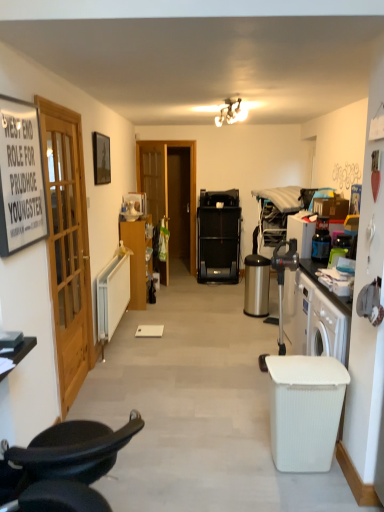
Question: Is satin silver trash can at lower right, which is the second trash bin/can in front-to-back order, at the right side of matte white light fixture at upper center?

Choices:
 (A) yes
 (B) no

Answer: (A)

Question: Is satin silver trash can at lower right, marked as the first trash bin/can in a back-to-front arrangement, wider than matte white light fixture at upper center?

Choices:
 (A) yes
 (B) no

Answer: (B)

Question: Considering the relative positions of satin silver trash can at lower right, which is the second trash bin/can in front-to-back order, and matte white light fixture at upper center in the image provided, is satin silver trash can at lower right, which is the second trash bin/can in front-to-back order, to the left of matte white light fixture at upper center from the viewer's perspective?

Choices:
 (A) no
 (B) yes

Answer: (A)

Question: Can you confirm if satin silver trash can at lower right, which is the second trash bin/can in front-to-back order, is thinner than matte white light fixture at upper center?

Choices:
 (A) no
 (B) yes

Answer: (B)

Question: Is satin silver trash can at lower right, positioned as the second trash bin/can in bottom-to-top order, turned away from matte white light fixture at upper center?

Choices:
 (A) yes
 (B) no

Answer: (B)

Question: From a real-world perspective, is satin silver trash can at lower right, marked as the first trash bin/can in a back-to-front arrangement, on top of matte white light fixture at upper center?

Choices:
 (A) no
 (B) yes

Answer: (A)

Question: From a real-world perspective, is satin silver trash can at lower right, which is the second trash bin/can in front-to-back order, located beneath wooden door at left?

Choices:
 (A) yes
 (B) no

Answer: (A)

Question: Is satin silver trash can at lower right, which is the second trash bin/can in front-to-back order, next to wooden door at left?

Choices:
 (A) no
 (B) yes

Answer: (A)

Question: Can you confirm if satin silver trash can at lower right, which is the second trash bin/can in front-to-back order, is positioned to the left of wooden door at left?

Choices:
 (A) no
 (B) yes

Answer: (A)

Question: Can you confirm if satin silver trash can at lower right, positioned as the second trash bin/can in bottom-to-top order, is positioned to the right of wooden door at left?

Choices:
 (A) no
 (B) yes

Answer: (B)

Question: Is the depth of satin silver trash can at lower right, positioned as the second trash bin/can in bottom-to-top order, less than that of wooden door at left?

Choices:
 (A) no
 (B) yes

Answer: (A)

Question: Is there a large distance between satin silver trash can at lower right, marked as the first trash bin/can in a back-to-front arrangement, and wooden door at left?

Choices:
 (A) yes
 (B) no

Answer: (A)

Question: From the image's perspective, does white ribbed plastic trash bin/can at lower right, which is counted as the first trash bin/can, starting from the bottom, appear higher than matte black picture frame at upper left, which is the first picture frame from back to front?

Choices:
 (A) yes
 (B) no

Answer: (B)